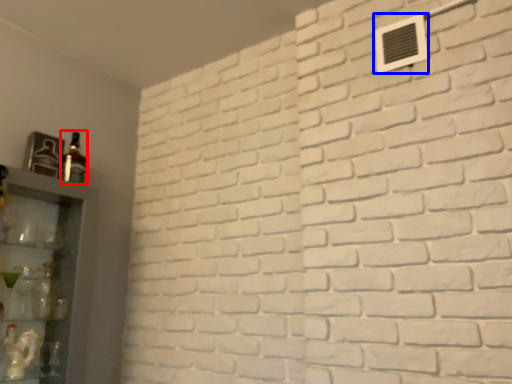
Question: Which object is closer to the camera taking this photo, bottle (highlighted by a red box) or air conditioning (highlighted by a blue box)?

Choices:
 (A) bottle
 (B) air conditioning

Answer: (B)